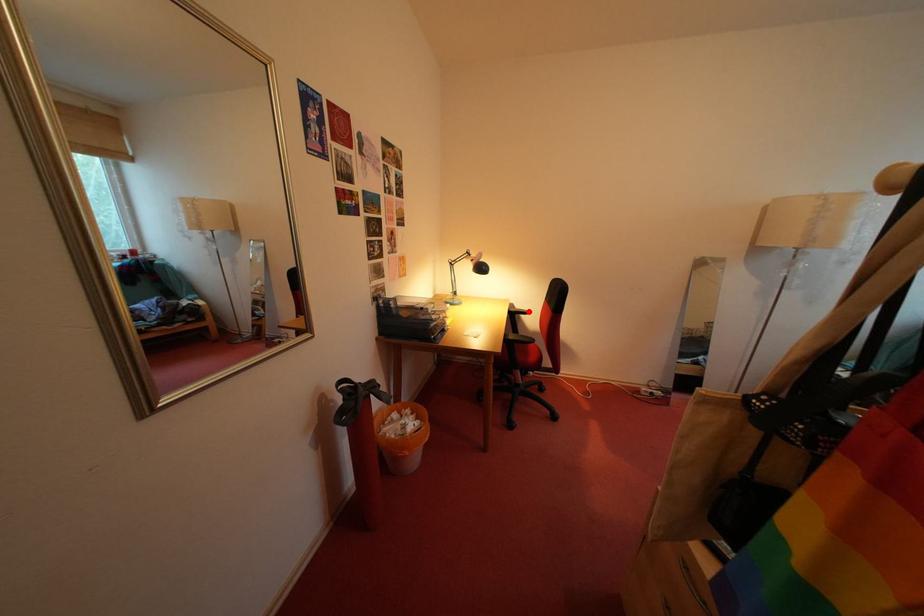
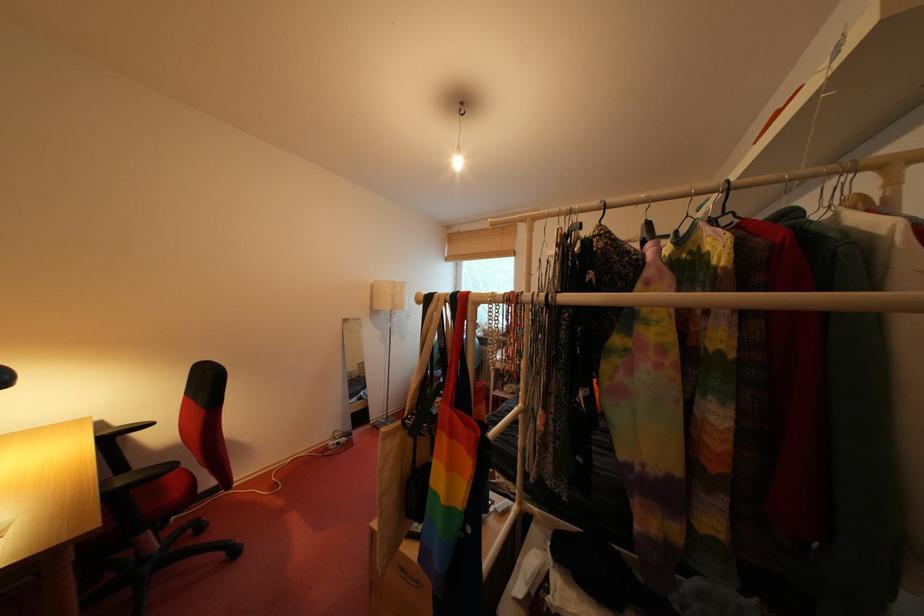
The point at the highlighted location is marked in the first image. Where is the corresponding point in the second image?

(131, 426)